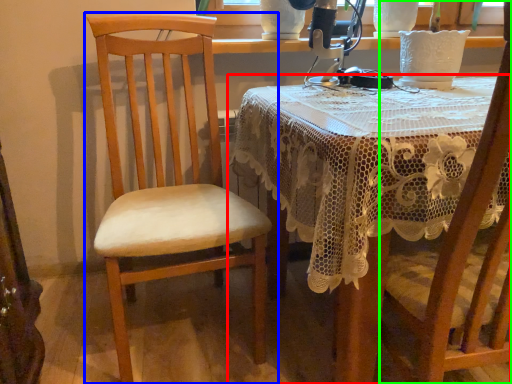
Question: Which object is the closest to the table (highlighted by a red box)? Choose among these: chair (highlighted by a blue box) or chair (highlighted by a green box).

Choices:
 (A) chair
 (B) chair

Answer: (B)